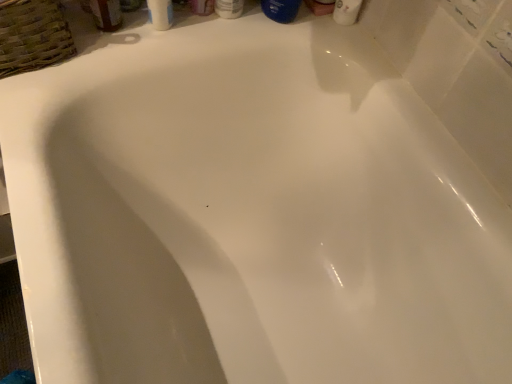
At what (x,y) coordinates should I click in order to perform the action: click on free location in front of translucent plastic mouthwash at upper left, the 2th mouthwash positioned from the right. Please return your answer as a coordinate pair (x, y). Image resolution: width=512 pixels, height=384 pixels. Looking at the image, I should click on (69, 72).